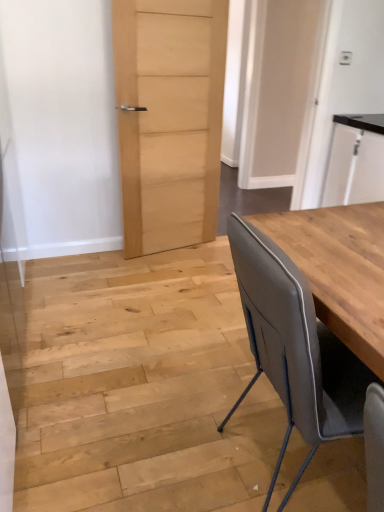
Question: Should I look upward or downward to see natural wood door at center, the 1th door when ordered from left to right?

Choices:
 (A) down
 (B) up

Answer: (B)

Question: From a real-world perspective, does matte gray chair at right stand above white glossy cabinet at upper right?

Choices:
 (A) no
 (B) yes

Answer: (A)

Question: Considering the relative positions of matte gray chair at right and white glossy cabinet at upper right in the image provided, is matte gray chair at right behind white glossy cabinet at upper right?

Choices:
 (A) no
 (B) yes

Answer: (A)

Question: Considering the relative sizes of matte gray chair at right and white glossy cabinet at upper right in the image provided, is matte gray chair at right bigger than white glossy cabinet at upper right?

Choices:
 (A) yes
 (B) no

Answer: (B)

Question: Could you tell me if matte gray chair at right is turned towards white glossy cabinet at upper right?

Choices:
 (A) no
 (B) yes

Answer: (A)

Question: From the image's perspective, is matte gray chair at right over white glossy cabinet at upper right?

Choices:
 (A) no
 (B) yes

Answer: (A)

Question: Can you confirm if matte gray chair at right is wider than white glossy cabinet at upper right?

Choices:
 (A) no
 (B) yes

Answer: (B)

Question: From the image's perspective, is white glossy cabinet at upper right under matte wood door at center, the 2th door positioned from the left?

Choices:
 (A) yes
 (B) no

Answer: (A)

Question: Can matte wood door at center, marked as the first door in a right-to-left arrangement, be found inside white glossy cabinet at upper right?

Choices:
 (A) no
 (B) yes

Answer: (A)

Question: Does white glossy cabinet at upper right have a larger size compared to matte wood door at center, the 2th door positioned from the left?

Choices:
 (A) yes
 (B) no

Answer: (A)

Question: From a real-world perspective, is white glossy cabinet at upper right physically above matte wood door at center, the 2th door positioned from the left?

Choices:
 (A) no
 (B) yes

Answer: (A)

Question: Is white glossy cabinet at upper right facing towards matte wood door at center, the 2th door positioned from the left?

Choices:
 (A) yes
 (B) no

Answer: (A)

Question: From a real-world perspective, is white glossy cabinet at upper right located beneath matte wood door at center, marked as the first door in a right-to-left arrangement?

Choices:
 (A) yes
 (B) no

Answer: (A)

Question: From the image's perspective, is matte wood door at center, marked as the first door in a right-to-left arrangement, above matte gray chair at right?

Choices:
 (A) yes
 (B) no

Answer: (A)